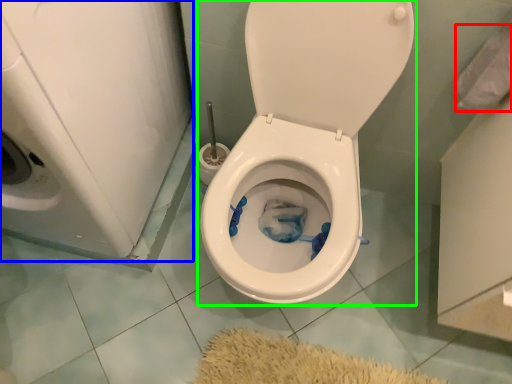
Question: Considering the real-world distances, which object is farthest from toilet paper (highlighted by a red box)? washer (highlighted by a blue box) or toilet (highlighted by a green box)?

Choices:
 (A) washer
 (B) toilet

Answer: (A)